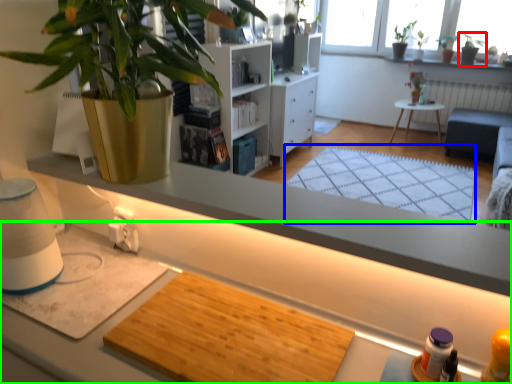
Question: Which object is the closest to the houseplant (highlighted by a red box)? Choose among these: mat (highlighted by a blue box) or desk (highlighted by a green box).

Choices:
 (A) mat
 (B) desk

Answer: (A)